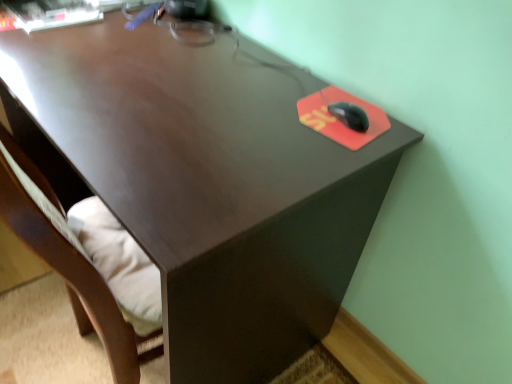
I want to click on vacant region to the left of brown wood swivel chair at lower left, so (34, 325).